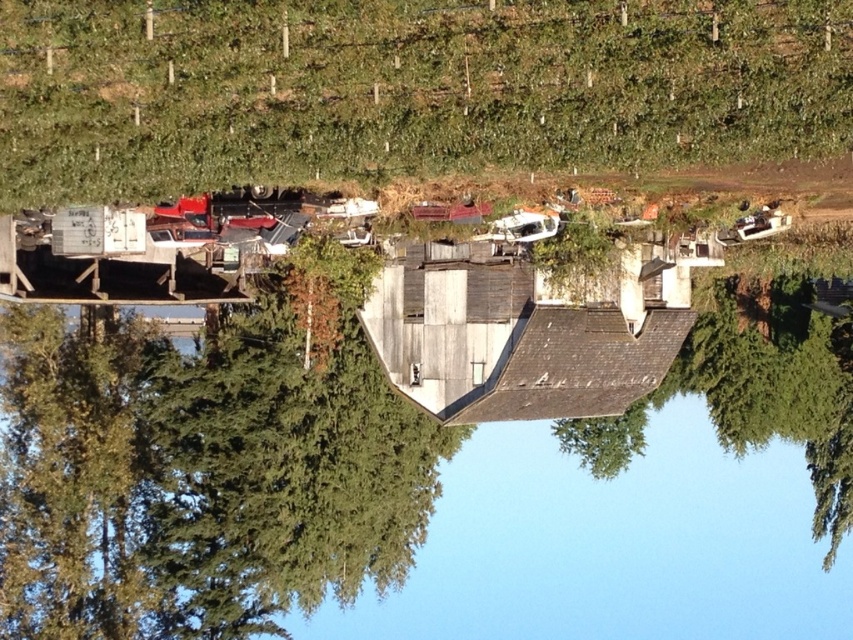
Can you confirm if green leafy hillside at upper center is positioned to the left of weathered wood hut at center?

Yes, green leafy hillside at upper center is to the left of weathered wood hut at center.

Can you confirm if green leafy hillside at upper center is positioned to the right of weathered wood hut at center?

In fact, green leafy hillside at upper center is to the left of weathered wood hut at center.

Between point (373, 44) and point (428, 252), which one is positioned behind?

The point (428, 252) is more distant.

At what (x,y) coordinates should I click in order to perform the action: click on green leafy hillside at upper center. Please return your answer as a coordinate pair (x, y). Looking at the image, I should click on (404, 88).

Find the location of `weathered wood hut at center`. weathered wood hut at center is located at coordinates (517, 336).

What do you see at coordinates (517, 336) in the screenshot?
I see `weathered wood hut at center` at bounding box center [517, 336].

Is point (602, 408) more distant than point (602, 280)?

That is True.

The image size is (853, 640). Find the location of `weathered wood hut at center`. weathered wood hut at center is located at coordinates (517, 336).

In the scene shown: Is green leafy hillside at upper center above green matte tree at center?

Yes, green leafy hillside at upper center is above green matte tree at center.

How distant is green leafy hillside at upper center from green matte tree at center?

A distance of 76.48 feet exists between green leafy hillside at upper center and green matte tree at center.

Does point (181, 51) come behind point (593, 240)?

No.

You are a GUI agent. You are given a task and a screenshot of the screen. Output one action in this format:
    pyautogui.click(x=<x>, y=<y>)
    Task: Click on the green leafy hillside at upper center
    
    Given the screenshot: What is the action you would take?
    pyautogui.click(x=404, y=88)